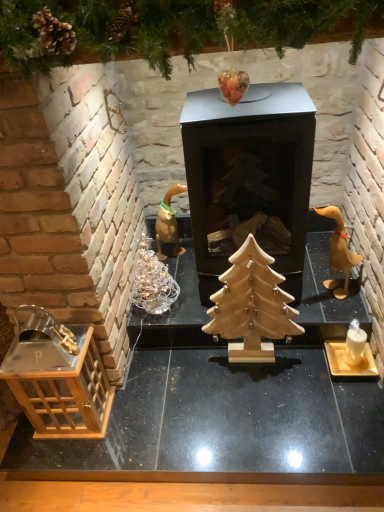
Where is `free area below natural wood christmas tree at center (from a real-world perspective)`? The image size is (384, 512). free area below natural wood christmas tree at center (from a real-world perspective) is located at coordinates (249, 362).